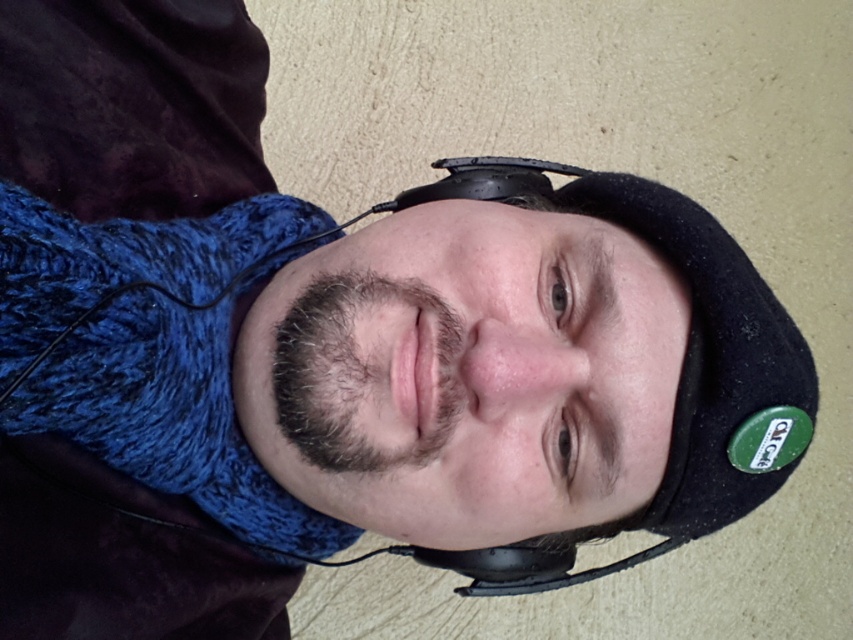
You are an AI analyzing a portrait of a person. The image has a coordinate system where the bottom left corner is the origin. The dark brown fuzzy beard at center is at point (361, 372). If you draw a vertical line through this point, which side of the line would the black over ear headphones on the person head be on?

The black over ear headphones on the person head are located to the right of the vertical line drawn through the point (361, 372) where the dark brown fuzzy beard at center is situated.

You are a photographer setting up a portrait shoot. You want to ensure that the black felt hat at center and the black matte headphones at center are both visible in the frame. Based on their sizes, which object should you focus on to ensure both are in focus?

The black felt hat at center is much taller than the black matte headphones at center, so focusing on the black felt hat at center would ensure both are in focus since it is the larger object.

You are a photographer adjusting the lighting for a portrait. The subject is wearing a black beanie hat with a green sticker and has headphones connected to a wire. You need to place a spotlight at point [683,394]. According to the image description, where will this spotlight illuminate?

The spotlight at point [683,394] will illuminate the black felt hat at center, as that is the location corresponding to that coordinate.